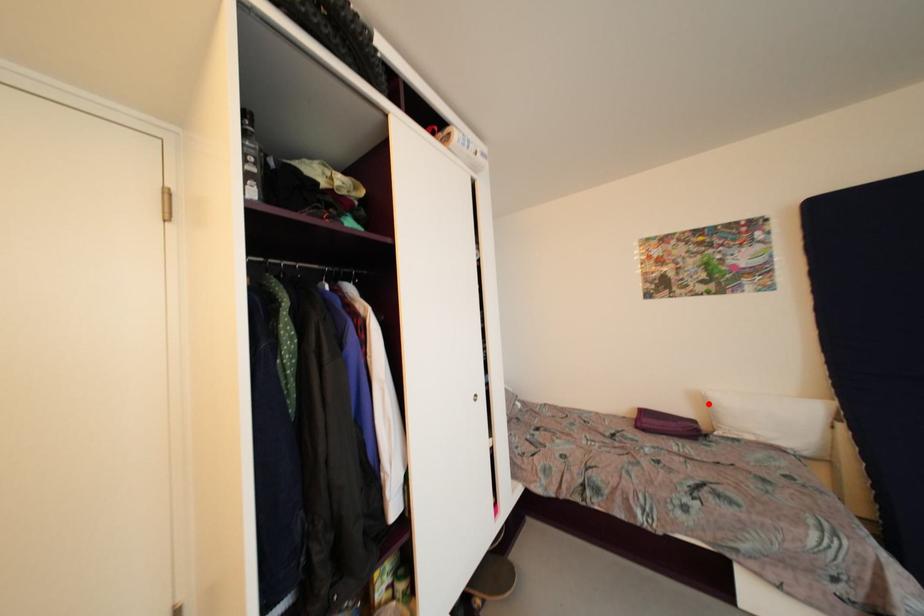
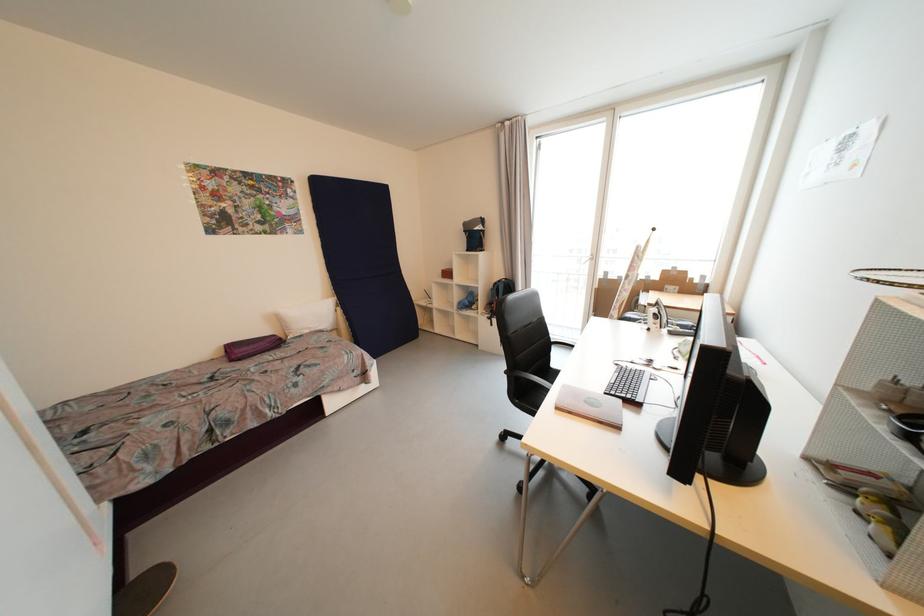
Question: I am providing you with two images of the same scene from different viewpoints. A red point is marked on the first image. Is the red point's position out of view in image 2?

Choices:
 (A) Yes
 (B) No

Answer: (B)